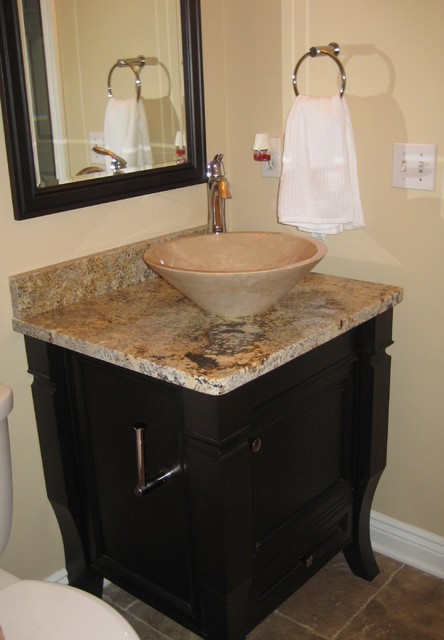
Where is `faucet`? This screenshot has height=640, width=444. faucet is located at coordinates (226, 189).